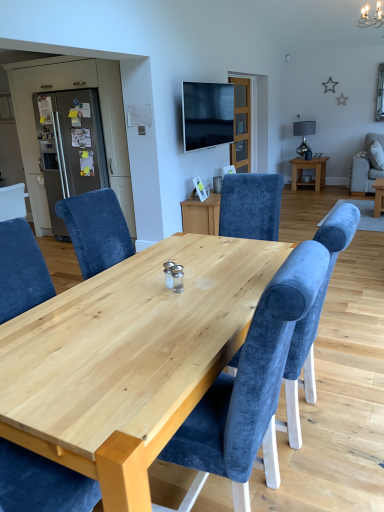
What do you see at coordinates (303, 135) in the screenshot? This screenshot has height=512, width=384. I see `matte glass lamp at upper center` at bounding box center [303, 135].

In the scene shown: Measure the distance between point (309,128) and camera.

7.26 meters.

At what (x,y) coordinates should I click in order to perform the action: click on flat screen tv at upper center. Please return your answer as a coordinate pair (x, y). The image size is (384, 512). Looking at the image, I should click on (207, 114).

What do you see at coordinates (207, 114) in the screenshot? I see `flat screen tv at upper center` at bounding box center [207, 114].

Describe the element at coordinates (70, 148) in the screenshot. I see `metallic gray refrigerator at left` at that location.

This screenshot has height=512, width=384. Find the location of `matte glass lamp at upper center`. matte glass lamp at upper center is located at coordinates point(303,135).

Considering the relative sizes of natural wood table at center and flat screen tv at upper center in the image provided, is natural wood table at center taller than flat screen tv at upper center?

Correct, natural wood table at center is much taller as flat screen tv at upper center.

Is natural wood table at center facing away from flat screen tv at upper center?

No.

Which point is more forward, (124,320) or (194,93)?

The point (124,320) is in front.

Locate an element on the screen. desk located in front of the flat screen tv at upper center is located at coordinates (129, 358).

From the image's perspective, is matte glass lamp at upper center over natural wood table at center?

Yes, from the image's perspective, matte glass lamp at upper center is over natural wood table at center.

Is matte glass lamp at upper center positioned far away from natural wood table at center?

Yes, matte glass lamp at upper center and natural wood table at center are located far from each other.

In terms of height, does matte glass lamp at upper center look taller or shorter compared to natural wood table at center?

In the image, matte glass lamp at upper center appears to be shorter than natural wood table at center.

Considering the points (293, 128) and (18, 348), which point is behind, point (293, 128) or point (18, 348)?

The point (293, 128) is behind.

From a real-world perspective, is metallic gray refrigerator at left physically located above or below flat screen tv at upper center?

In terms of real-world spatial position, metallic gray refrigerator at left is below flat screen tv at upper center.

Could you tell me if metallic gray refrigerator at left is facing flat screen tv at upper center?

No.

Identify the location of television located above the metallic gray refrigerator at left (from a real-world perspective). (207, 114).

Considering the sizes of objects satin silver refrigerator at left and natural wood table at center in the image provided, who is thinner, satin silver refrigerator at left or natural wood table at center?

With smaller width is satin silver refrigerator at left.

Locate an element on the screen. The height and width of the screenshot is (512, 384). desk below the satin silver refrigerator at left (from the image's perspective) is located at coordinates 129,358.

Is satin silver refrigerator at left aimed at natural wood table at center?

No, satin silver refrigerator at left does not turn towards natural wood table at center.

Consider the image. Are light oak table at center and natural wood table at center making contact?

No, light oak table at center is not touching natural wood table at center.

Is light oak table at center positioned beyond the bounds of natural wood table at center?

Indeed, light oak table at center is completely outside natural wood table at center.

Considering the relative positions of light oak table at center and natural wood table at center in the image provided, is light oak table at center to the left of natural wood table at center from the viewer's perspective?

No.

Is the position of light oak table at center more distant than that of natural wood table at center?

Yes, it is.

Are matte glass lamp at upper center and clear glass door at center far apart?

matte glass lamp at upper center is far away from clear glass door at center.

Is clear glass door at center surrounded by matte glass lamp at upper center?

That's incorrect, clear glass door at center is not inside matte glass lamp at upper center.

Is matte glass lamp at upper center oriented away from clear glass door at center?

No, matte glass lamp at upper center's orientation is not away from clear glass door at center.

Can you tell me how much matte glass lamp at upper center and clear glass door at center differ in facing direction?

matte glass lamp at upper center and clear glass door at center are facing 42.6 degrees away from each other.

From the picture: From a real-world perspective, does light oak table at center stand above matte gray refrigerator at left?

Actually, light oak table at center is physically below matte gray refrigerator at left in the real world.

Between light oak table at center and matte gray refrigerator at left, which one has smaller size?

Smaller between the two is matte gray refrigerator at left.

Does light oak table at center have a greater height compared to matte gray refrigerator at left?

Yes, light oak table at center is taller than matte gray refrigerator at left.

Are light oak table at center and matte gray refrigerator at left making contact?

light oak table at center and matte gray refrigerator at left are clearly separated.

Find the location of `desk below the flat screen tv at upper center (from a real-world perspective)`. desk below the flat screen tv at upper center (from a real-world perspective) is located at coordinates (129, 358).

Find the location of a particular element. This screenshot has width=384, height=512. lamp above the natural wood table at center (from a real-world perspective) is located at coordinates pyautogui.click(x=303, y=135).

Considering their positions, is metallic gray refrigerator at left positioned closer to flat screen tv at upper center than natural wood table at center?

Among the two, metallic gray refrigerator at left is located nearer to flat screen tv at upper center.

Based on their spatial positions, is matte gray refrigerator at left or metallic gray refrigerator at left closer to light oak table at center?

metallic gray refrigerator at left.

Considering their positions, is flat screen tv at upper center positioned closer to matte glass lamp at upper center than metallic gray refrigerator at left?

Based on the image, flat screen tv at upper center appears to be nearer to matte glass lamp at upper center.

From the image, which object appears to be nearer to clear glass door at center, light oak table at center or metallic gray refrigerator at left?

light oak table at center lies closer to clear glass door at center than the other object.

Looking at the image, which one is located closer to natural wood table at center, velvet blue chair at right, which appears as the 1th chair when viewed from the top, or satin silver refrigerator at left?

Among the two, satin silver refrigerator at left is located nearer to natural wood table at center.

Which object lies further to the anchor point clear glass door at center, metallic gray refrigerator at left or velvet blue chair at center, which appears as the 1th chair when ordered from the bottom?

velvet blue chair at center, which appears as the 1th chair when ordered from the bottom, is further to clear glass door at center.

Considering their positions, is matte glass lamp at upper center positioned further to satin silver refrigerator at left than natural wood table at center?

matte glass lamp at upper center is positioned further to the anchor satin silver refrigerator at left.

Which object lies further to the anchor point natural wood table at center, metallic gray refrigerator at left or satin silver refrigerator at left?

Based on the image, metallic gray refrigerator at left appears to be further to natural wood table at center.

Find the location of a particular element. glass door positioned between natural wood table at center and matte glass lamp at upper center from near to far is located at coordinates pos(241,126).

Image resolution: width=384 pixels, height=512 pixels. In order to click on refrigerator between velvet blue chair at center, the 2th chair when ordered from back to front, and matte glass lamp at upper center in the front-back direction in this screenshot , I will do `click(70, 148)`.

This screenshot has width=384, height=512. In order to click on refrigerator between velvet blue chair at center, which is the 1th chair from front to back, and clear glass door at center, along the z-axis in this screenshot , I will do `click(70, 148)`.

Image resolution: width=384 pixels, height=512 pixels. I want to click on television between velvet blue chair at center, the second chair in the right-to-left sequence, and light oak table at center in the front-back direction, so click(207, 114).